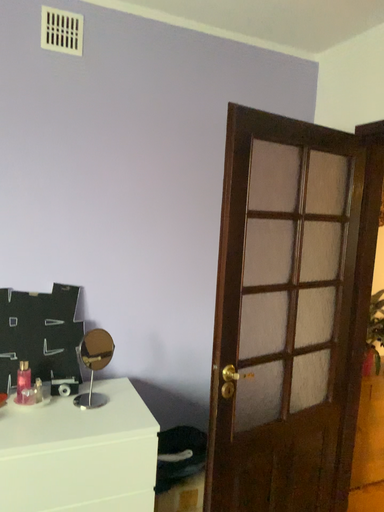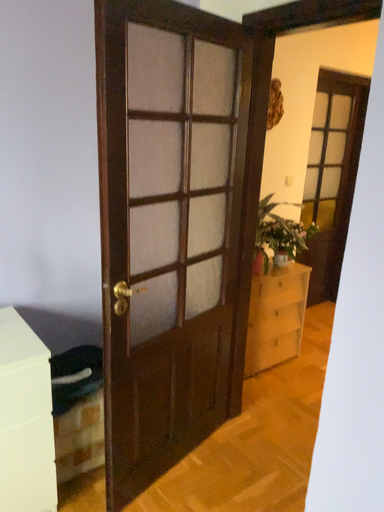
Question: Which way did the camera rotate in the video?

Choices:
 (A) rotated right
 (B) rotated left

Answer: (A)